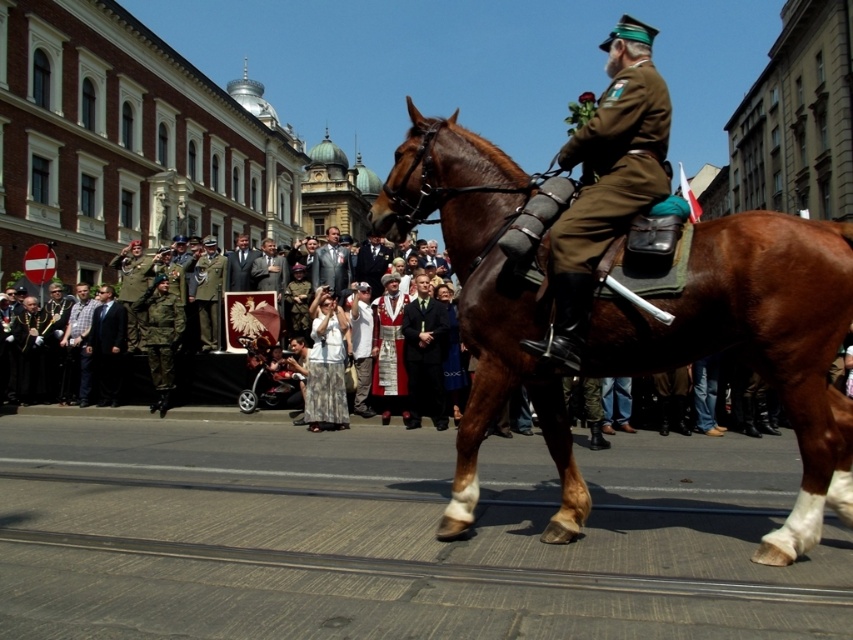
Question: Based on their relative distances, which object is nearer to the brown glossy horse at center?

Choices:
 (A) light brown suit at center
 (B) matte brown uniform at center
 (C) dark gray suit at center

Answer: (B)

Question: Does brown glossy horse at center have a lesser width compared to dark gray suit at center?

Choices:
 (A) no
 (B) yes

Answer: (B)

Question: Which of the following is the closest to the observer?

Choices:
 (A) (236, 269)
 (B) (614, 186)
 (C) (329, 237)

Answer: (B)

Question: Estimate the real-world distances between objects in this image. Which object is closer to the dark gray suit at center?

Choices:
 (A) matte brown uniform at center
 (B) brown glossy horse at center

Answer: (B)

Question: Can you confirm if matte brown uniform at center is positioned to the left of dark gray suit at center?

Choices:
 (A) no
 (B) yes

Answer: (A)

Question: Can you confirm if brown glossy horse at center is positioned below light brown suit at center?

Choices:
 (A) no
 (B) yes

Answer: (B)